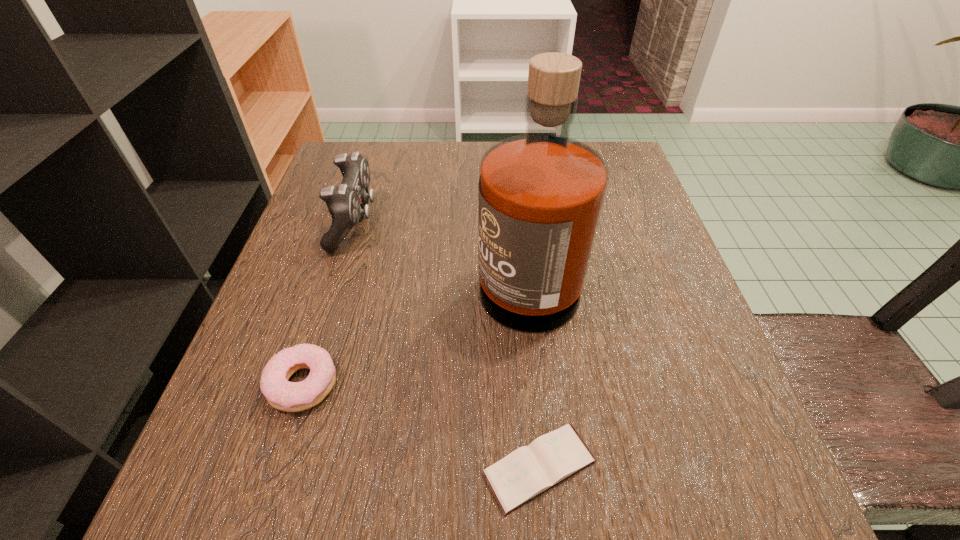
Image resolution: width=960 pixels, height=540 pixels. Identify the location of free space between the second nearest object and the liquor. (415, 326).

Locate an element on the screen. This screenshot has width=960, height=540. free space between the liquor and the doughnut is located at coordinates tap(415, 326).

Select which object is the closest to the shortest object. Please provide its 2D coordinates. Your answer should be formatted as a tuple, i.e. [(x, y)], where the tuple contains the x and y coordinates of a point satisfying the conditions above.

[(540, 195)]

Find the location of a particular element. The width and height of the screenshot is (960, 540). the second closest object to the liquor is located at coordinates (281, 394).

Locate an element on the screen. The width and height of the screenshot is (960, 540). vacant region that satisfies the following two spatial constraints: 1. on the front side of the shortest object; 2. on the left side of the second nearest object is located at coordinates (276, 467).

Identify the location of vacant space that satisfies the following two spatial constraints: 1. on the surface of the control with buttons; 2. on the left side of the shortest object. This screenshot has width=960, height=540. (279, 467).